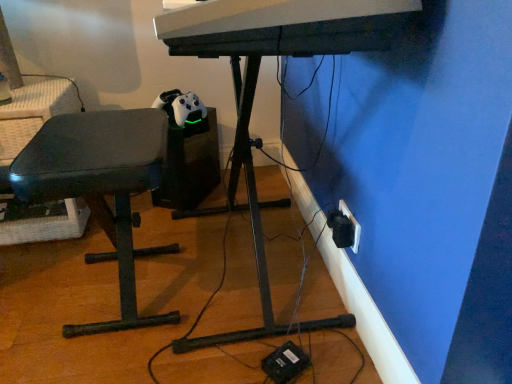
This screenshot has width=512, height=384. I want to click on free space to the left of matte black bench at left, so click(x=33, y=288).